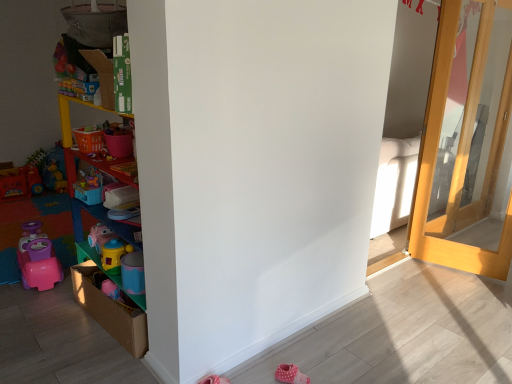
I want to click on free space in front of multicolored plastic shelves at left, so click(90, 360).